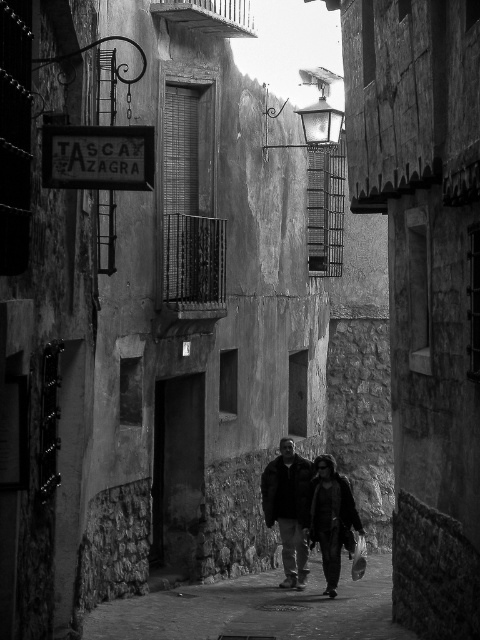
Does smooth stone pavement at center have a greater width compared to dark brown leather jacket at center?

Yes, smooth stone pavement at center is wider than dark brown leather jacket at center.

Which of these two, smooth stone pavement at center or dark brown leather jacket at center, stands shorter?

smooth stone pavement at center

Is point (321, 627) behind point (289, 451)?

No, it is in front of (289, 451).

Find the location of `smooth stone pavement at center`. smooth stone pavement at center is located at coordinates (256, 609).

Does smooth stone pavement at center have a larger size compared to dark fabric jacket at center?

Correct, smooth stone pavement at center is larger in size than dark fabric jacket at center.

The image size is (480, 640). Describe the element at coordinates (256, 609) in the screenshot. I see `smooth stone pavement at center` at that location.

What are the coordinates of `smooth stone pavement at center` in the screenshot? It's located at (256, 609).

Is point (337, 540) positioned in front of point (299, 573)?

Yes, point (337, 540) is in front of point (299, 573).

Does dark fabric jacket at center appear on the right side of dark brown leather jacket at center?

Yes, dark fabric jacket at center is to the right of dark brown leather jacket at center.

Identify the location of dark fabric jacket at center. (309, 513).

Locate an element on the screen. The width and height of the screenshot is (480, 640). dark fabric jacket at center is located at coordinates (309, 513).